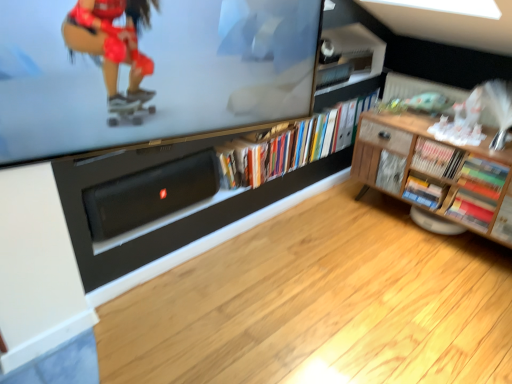
Locate an element on the screen. This screenshot has height=384, width=512. free spot above black matte speaker at lower center (from a real-world perspective) is located at coordinates (145, 167).